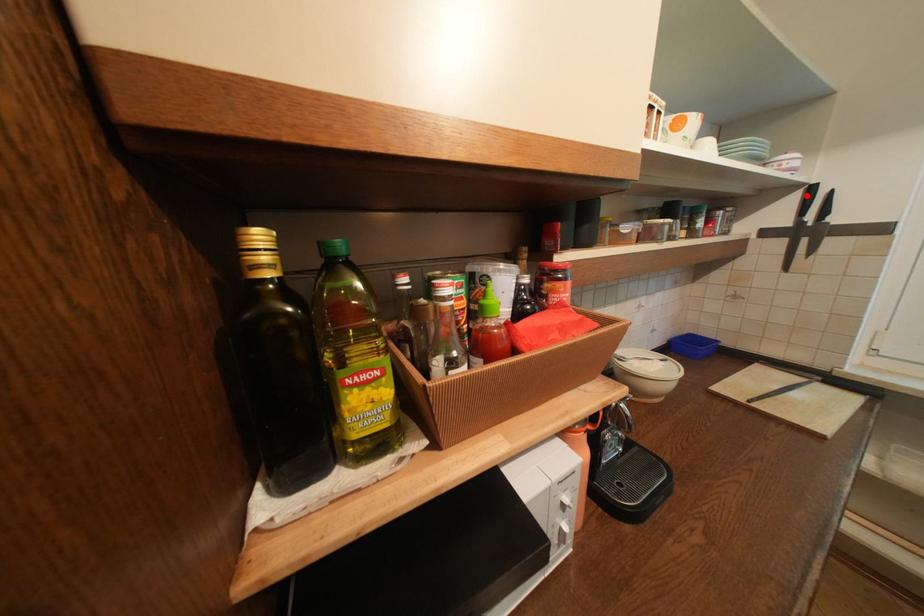
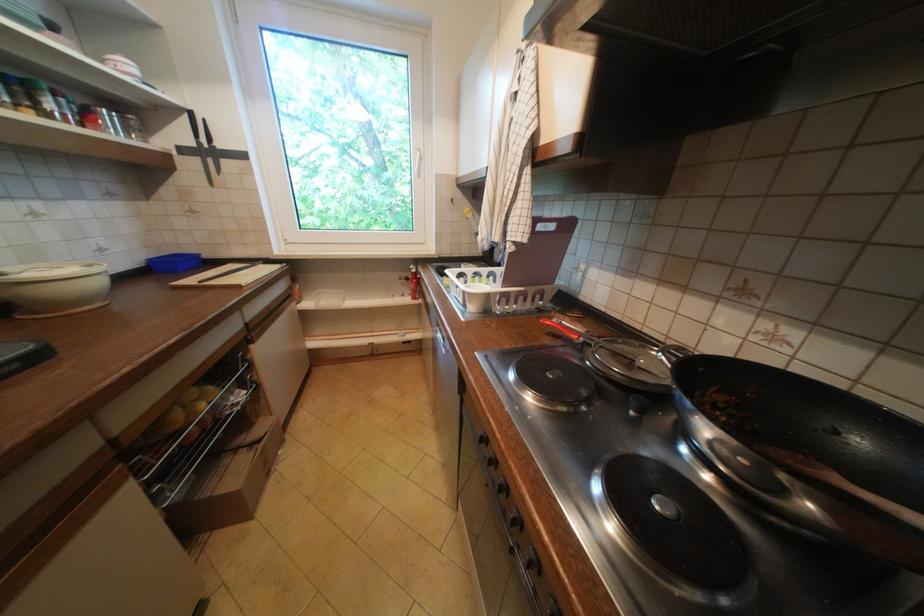
In the second image, find the point that corresponds to the highlighted location in the first image.

(195, 119)